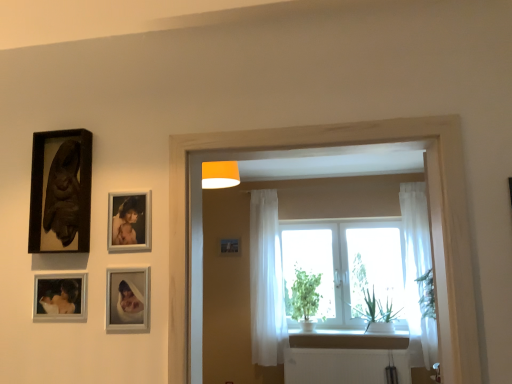
This screenshot has width=512, height=384. Identify the location of green leafy plant at window, which is the 1th plant in right-to-left order. (377, 313).

Image resolution: width=512 pixels, height=384 pixels. Find the location of `green leafy plant at window, which ranks as the second plant in right-to-left order`. green leafy plant at window, which ranks as the second plant in right-to-left order is located at coordinates (305, 294).

Identify the location of white sheer curtain at right, positioned as the second curtain in left-to-right order. (417, 266).

In order to face white matte window frame at center, should I rotate leftwards or rightwards?

To align with it, rotate right about 6.717°.

You are a GUI agent. You are given a task and a screenshot of the screen. Output one action in this format:
    pyautogui.click(x=<x>, y=<y>)
    Task: Click on the white sheer curtain at center, placed as the 2th curtain when sorted from right to left
    
    Given the screenshot: What is the action you would take?
    click(x=266, y=281)

The width and height of the screenshot is (512, 384). Identify the location of white plastic radiator at lower center. pos(343,366).

Can you confirm if white plastic radiator at lower center is taller than transparent glass window at center?

In fact, white plastic radiator at lower center may be shorter than transparent glass window at center.

Is white plastic radiator at lower center surrounding transparent glass window at center?

No, transparent glass window at center is located outside of white plastic radiator at lower center.

Does white plastic radiator at lower center have a smaller size compared to transparent glass window at center?

Correct, white plastic radiator at lower center occupies less space than transparent glass window at center.

From the image's perspective, relative to transparent glass window at center, is white plastic radiator at lower center above or below?

Clearly, from the image's perspective, white plastic radiator at lower center is below transparent glass window at center.

Does white sheer curtain at right, arranged as the first curtain when viewed from the right, have a lesser height compared to matte black picture frame at center?

No, white sheer curtain at right, arranged as the first curtain when viewed from the right, is not shorter than matte black picture frame at center.

From a real-world perspective, which curtain is the 2nd one underneath the matte black picture frame at center? Please provide its 2D coordinates.

[(417, 266)]

Considering the relative positions of white sheer curtain at right, arranged as the first curtain when viewed from the right, and matte black picture frame at center in the image provided, is white sheer curtain at right, arranged as the first curtain when viewed from the right, in front of matte black picture frame at center?

Yes, the depth of white sheer curtain at right, arranged as the first curtain when viewed from the right, is less than that of matte black picture frame at center.

Is the surface of green leafy plant at window, which is the first plant in left-to-right order, in direct contact with matte black picture frame at center?

No, green leafy plant at window, which is the first plant in left-to-right order, is not beside matte black picture frame at center.

From the image's perspective, which one is positioned lower, green leafy plant at window, which ranks as the second plant in right-to-left order, or matte black picture frame at center?

green leafy plant at window, which ranks as the second plant in right-to-left order.

From a real-world perspective, between green leafy plant at window, which ranks as the second plant in right-to-left order, and matte black picture frame at center, who is vertically lower?

In real-world perspective, green leafy plant at window, which ranks as the second plant in right-to-left order, is lower.

Does green leafy plant at window, which is the first plant in left-to-right order, have a lesser width compared to matte black picture frame at center?

No, green leafy plant at window, which is the first plant in left-to-right order, is not thinner than matte black picture frame at center.

From the picture: Which of these two, white sheer curtain at right, positioned as the second curtain in left-to-right order, or green leafy plant at window, the second plant positioned from the left, is smaller?

white sheer curtain at right, positioned as the second curtain in left-to-right order.

Can you confirm if white sheer curtain at right, arranged as the first curtain when viewed from the right, is taller than green leafy plant at window, the second plant positioned from the left?

Indeed, white sheer curtain at right, arranged as the first curtain when viewed from the right, has a greater height compared to green leafy plant at window, the second plant positioned from the left.

From a real-world perspective, relative to green leafy plant at window, the second plant positioned from the left, is white sheer curtain at right, positioned as the second curtain in left-to-right order, vertically above or below?

From a real-world perspective, white sheer curtain at right, positioned as the second curtain in left-to-right order, is physically above green leafy plant at window, the second plant positioned from the left.

Is white sheer curtain at right, arranged as the first curtain when viewed from the right, oriented towards white sheer curtain at center, placed as the 1th curtain when sorted from left to right?

No, white sheer curtain at right, arranged as the first curtain when viewed from the right, is not oriented towards white sheer curtain at center, placed as the 1th curtain when sorted from left to right.

From the picture: Can you confirm if white sheer curtain at right, positioned as the second curtain in left-to-right order, is shorter than white sheer curtain at center, placed as the 1th curtain when sorted from left to right?

Incorrect, the height of white sheer curtain at right, positioned as the second curtain in left-to-right order, does not fall short of that of white sheer curtain at center, placed as the 1th curtain when sorted from left to right.

Is white sheer curtain at right, positioned as the second curtain in left-to-right order, with white sheer curtain at center, placed as the 2th curtain when sorted from right to left?

No, white sheer curtain at right, positioned as the second curtain in left-to-right order, is not touching white sheer curtain at center, placed as the 2th curtain when sorted from right to left.

In the scene shown: Is white sheer curtain at center, placed as the 2th curtain when sorted from right to left, inside white sheer curtain at right, arranged as the first curtain when viewed from the right?

Actually, white sheer curtain at center, placed as the 2th curtain when sorted from right to left, is outside white sheer curtain at right, arranged as the first curtain when viewed from the right.

Is green leafy plant at window, which is the 1th plant in right-to-left order, touching white sheer curtain at right, arranged as the first curtain when viewed from the right?

No, green leafy plant at window, which is the 1th plant in right-to-left order, is not making contact with white sheer curtain at right, arranged as the first curtain when viewed from the right.

Is green leafy plant at window, which is the 1th plant in right-to-left order, aimed at white sheer curtain at right, arranged as the first curtain when viewed from the right?

No, green leafy plant at window, which is the 1th plant in right-to-left order, is not turned towards white sheer curtain at right, arranged as the first curtain when viewed from the right.

Is the position of green leafy plant at window, the second plant positioned from the left, less distant than that of white sheer curtain at right, positioned as the second curtain in left-to-right order?

That is False.

Measure the distance between green leafy plant at window, which is the 1th plant in right-to-left order, and white sheer curtain at right, positioned as the second curtain in left-to-right order.

49.02 centimeters.

Is white matte window frame at center not within white sheer curtain at center, placed as the 1th curtain when sorted from left to right?

Indeed, white matte window frame at center is completely outside white sheer curtain at center, placed as the 1th curtain when sorted from left to right.

Which object is positioned more to the right, white matte window frame at center or white sheer curtain at center, placed as the 2th curtain when sorted from right to left?

From the viewer's perspective, white matte window frame at center appears more on the right side.

Identify the location of the 2nd curtain behind the white matte window frame at center. The height and width of the screenshot is (384, 512). (266, 281).

Does white matte window frame at center have a greater width compared to white sheer curtain at center, placed as the 2th curtain when sorted from right to left?

Correct, the width of white matte window frame at center exceeds that of white sheer curtain at center, placed as the 2th curtain when sorted from right to left.

Locate an element on the screen. The image size is (512, 384). radiator below the transparent glass window at center (from a real-world perspective) is located at coordinates point(343,366).

I want to click on curtain that is the 2nd object to the right of the matte black picture frame at center, starting at the anchor, so click(x=417, y=266).

Estimate the real-world distances between objects in this image. Which object is closer to white plastic radiator at lower center, green leafy plant at window, the second plant positioned from the left, or white sheer curtain at right, arranged as the first curtain when viewed from the right?

The object closer to white plastic radiator at lower center is green leafy plant at window, the second plant positioned from the left.

Looking at the image, which one is located closer to green leafy plant at window, which is the 1th plant in right-to-left order, white sheer curtain at center, placed as the 2th curtain when sorted from right to left, or white sheer curtain at right, arranged as the first curtain when viewed from the right?

The object closer to green leafy plant at window, which is the 1th plant in right-to-left order, is white sheer curtain at right, arranged as the first curtain when viewed from the right.

Based on their spatial positions, is green leafy plant at window, which is the 1th plant in right-to-left order, or green leafy plant at window, which ranks as the second plant in right-to-left order, closer to matte black picture frame at center?

green leafy plant at window, which ranks as the second plant in right-to-left order, lies closer to matte black picture frame at center than the other object.

From the image, which object appears to be farther from white sheer curtain at center, placed as the 1th curtain when sorted from left to right, white sheer curtain at right, positioned as the second curtain in left-to-right order, or green leafy plant at window, which ranks as the second plant in right-to-left order?

Based on the image, white sheer curtain at right, positioned as the second curtain in left-to-right order, appears to be further to white sheer curtain at center, placed as the 1th curtain when sorted from left to right.

Looking at the image, which one is located closer to white matte window frame at center, white sheer curtain at right, positioned as the second curtain in left-to-right order, or matte black picture frame at center?

Among the two, white sheer curtain at right, positioned as the second curtain in left-to-right order, is located nearer to white matte window frame at center.

When comparing their distances from green leafy plant at window, which is the 1th plant in right-to-left order, does transparent glass window at center or white plastic radiator at lower center seem further?

white plastic radiator at lower center.

When comparing their distances from matte black picture frame at center, does white sheer curtain at center, placed as the 1th curtain when sorted from left to right, or white sheer curtain at right, arranged as the first curtain when viewed from the right, seem closer?

Among the two, white sheer curtain at center, placed as the 1th curtain when sorted from left to right, is located nearer to matte black picture frame at center.

From the image, which object appears to be nearer to transparent glass window at center, matte black picture frame at center or green leafy plant at window, which is the 1th plant in right-to-left order?

green leafy plant at window, which is the 1th plant in right-to-left order, is closer to transparent glass window at center.

The width and height of the screenshot is (512, 384). What are the coordinates of `curtain located between matte black picture frame at center and green leafy plant at window, the second plant positioned from the left, in the left-right direction` in the screenshot? It's located at (266, 281).

This screenshot has width=512, height=384. What are the coordinates of `curtain between white matte window frame at center and white sheer curtain at center, placed as the 1th curtain when sorted from left to right, in the front-back direction` in the screenshot? It's located at (417, 266).

Where is `radiator situated between matte black picture frame at center and white sheer curtain at right, positioned as the second curtain in left-to-right order, from left to right`? This screenshot has width=512, height=384. radiator situated between matte black picture frame at center and white sheer curtain at right, positioned as the second curtain in left-to-right order, from left to right is located at coordinates (343, 366).

Identify the location of window between white sheer curtain at right, arranged as the first curtain when viewed from the right, and white plastic radiator at lower center vertically. (346, 266).